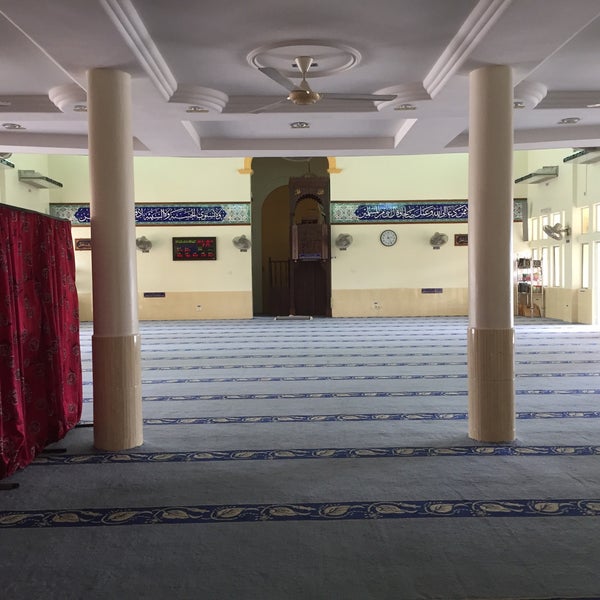
Image resolution: width=600 pixels, height=600 pixels. I want to click on fan, so click(314, 92).